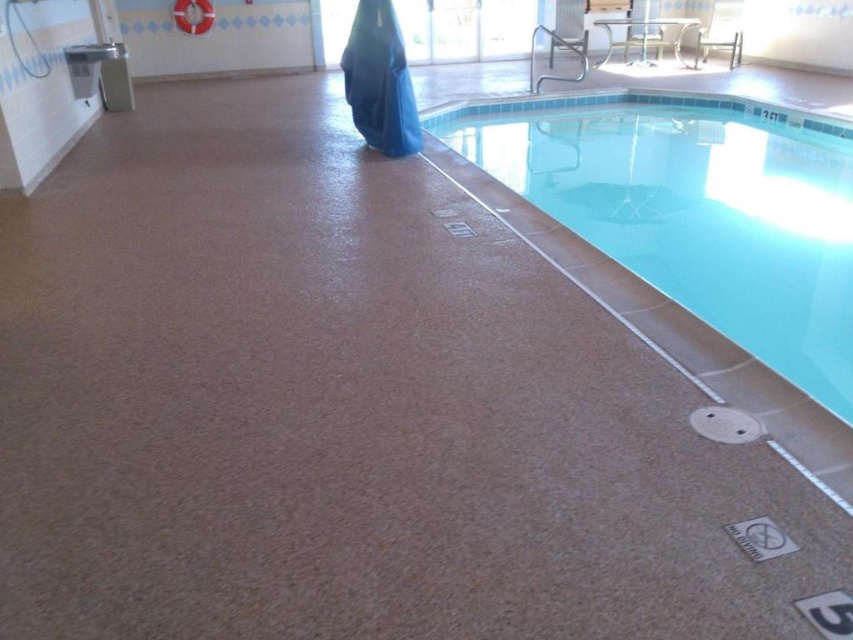
Question: Can you confirm if smooth tile pool at center is positioned to the right of blue fabric robe at upper center?

Choices:
 (A) no
 (B) yes

Answer: (B)

Question: Is smooth tile pool at center below blue fabric robe at upper center?

Choices:
 (A) no
 (B) yes

Answer: (B)

Question: Is smooth tile pool at center to the right of blue fabric robe at upper center from the viewer's perspective?

Choices:
 (A) no
 (B) yes

Answer: (B)

Question: Among these objects, which one is farthest from the camera?

Choices:
 (A) smooth tile pool at center
 (B) blue fabric robe at upper center

Answer: (B)